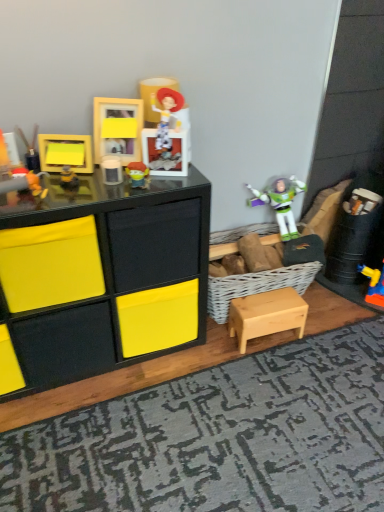
Question: From the image's perspective, is matte black frame at upper left, the first toy when ordered from left to right, above or below light wood table at lower right?

Choices:
 (A) below
 (B) above

Answer: (B)

Question: Relative to light wood table at lower right, is matte black frame at upper left, the first toy when ordered from left to right, in front or behind?

Choices:
 (A) front
 (B) behind

Answer: (A)

Question: Which object is positioned farthest from the matte plastic buzz lightyear at center, which appears as the sixth toy when viewed from the left?

Choices:
 (A) matte black frame at upper left, the 6th toy in the right-to-left sequence
 (B) yellow matte frame at upper left, the fourth toy when ordered from right to left
 (C) matte black chest of drawers at left
 (D) matte yellow frame at upper center, which is counted as the fifth toy, starting from the left
 (E) matte yellow frame at upper left, which appears as the fourth toy when viewed from the left

Answer: (C)

Question: Which of these objects is positioned closest to the matte black chest of drawers at left?

Choices:
 (A) matte black frame at upper left, the 6th toy in the right-to-left sequence
 (B) light wood table at lower right
 (C) matte yellow frame at upper left, which ranks as the 3th toy in right-to-left order
 (D) textured gray rug at lower center
 (E) matte black toy at left, placed as the fifth toy when sorted from right to left

Answer: (C)